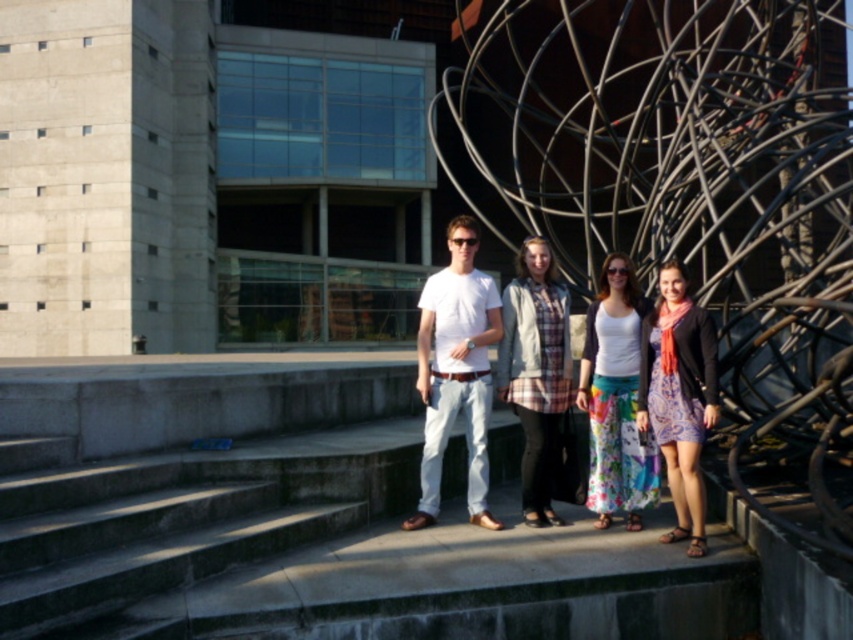
Is patterned fabric dress at center further to camera compared to plaid fabric shirt at center?

No, it is not.

Can you confirm if patterned fabric dress at center is positioned below plaid fabric shirt at center?

Yes, patterned fabric dress at center is below plaid fabric shirt at center.

The image size is (853, 640). Describe the element at coordinates (679, 396) in the screenshot. I see `patterned fabric dress at center` at that location.

Find the location of a particular element. The image size is (853, 640). patterned fabric dress at center is located at coordinates (679, 396).

Who is lower down, white cotton tank top at center or plaid fabric shirt at center?

white cotton tank top at center is lower down.

Which of these two, white cotton tank top at center or plaid fabric shirt at center, stands shorter?

With less height is white cotton tank top at center.

This screenshot has width=853, height=640. What are the coordinates of `white cotton tank top at center` in the screenshot? It's located at pos(614,400).

Consider the image. Between white cotton tank top at center and patterned fabric dress at center, which one appears on the right side from the viewer's perspective?

patterned fabric dress at center is more to the right.

Does white cotton tank top at center have a larger size compared to patterned fabric dress at center?

Correct, white cotton tank top at center is larger in size than patterned fabric dress at center.

In the scene shown: Measure the distance between white cotton tank top at center and camera.

white cotton tank top at center and camera are 25.37 feet apart from each other.

Locate an element on the screen. white cotton tank top at center is located at coordinates [x=614, y=400].